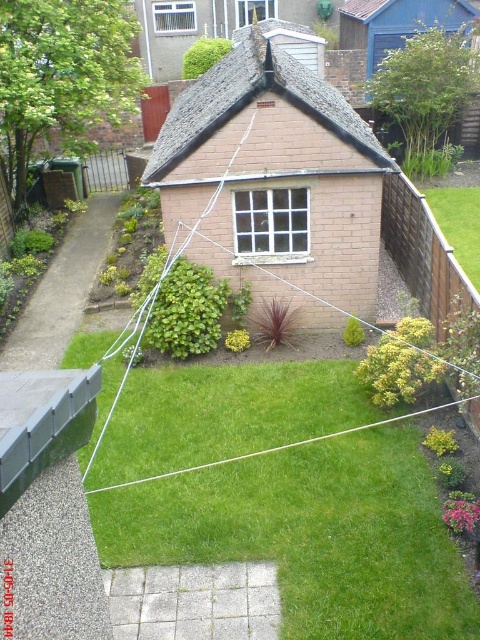
Question: Is green grass at center wider than green grass at right?

Choices:
 (A) yes
 (B) no

Answer: (A)

Question: Which object is farther from the camera taking this photo?

Choices:
 (A) green grass at right
 (B) green grass at center

Answer: (A)

Question: Does green grass at center have a larger size compared to green grass at right?

Choices:
 (A) no
 (B) yes

Answer: (B)

Question: Among these objects, which one is nearest to the camera?

Choices:
 (A) green grass at right
 (B) green grass at center

Answer: (B)

Question: Can you confirm if green grass at center is positioned above green grass at right?

Choices:
 (A) yes
 (B) no

Answer: (B)